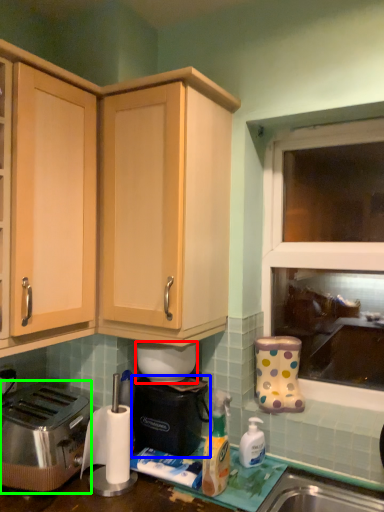
Question: Which is farther away from appliance (highlighted by a red box)? appliance (highlighted by a blue box) or toaster (highlighted by a green box)?

Choices:
 (A) appliance
 (B) toaster

Answer: (B)